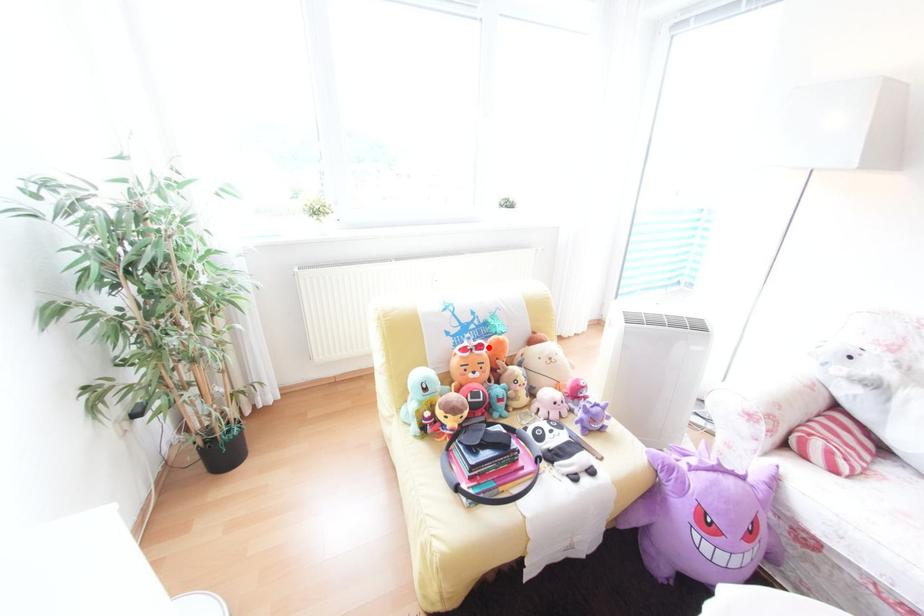
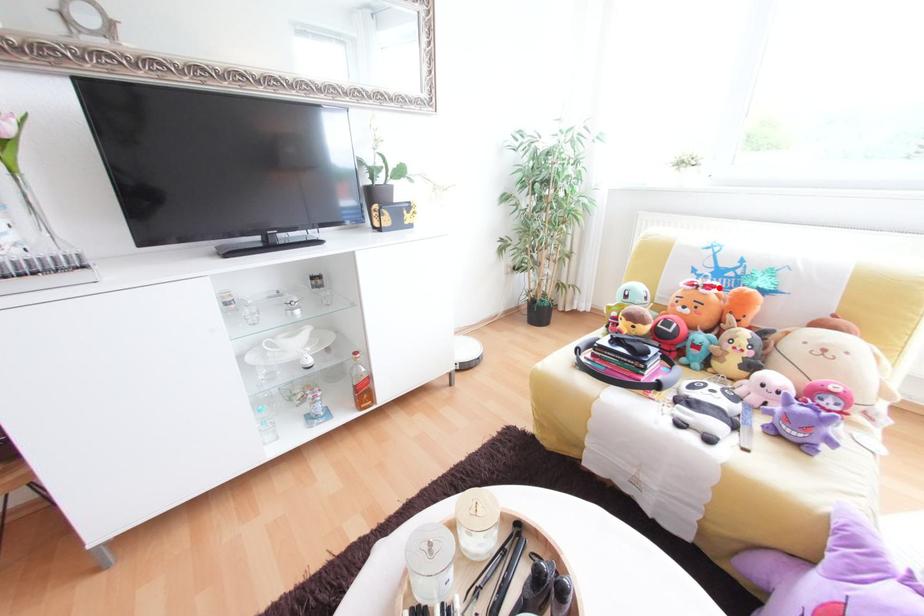
I am providing you with two images of the same scene from different viewpoints. A red point is marked on the first image and another point is marked on the second image. Is the red point in image1 aligned with the point shown in image2?

Yes